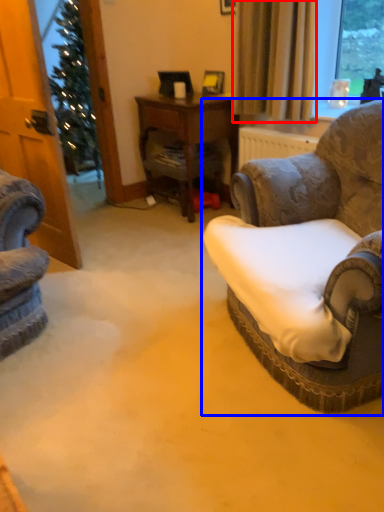
Question: Which object is closer to the camera taking this photo, curtain (highlighted by a red box) or chair (highlighted by a blue box)?

Choices:
 (A) curtain
 (B) chair

Answer: (B)